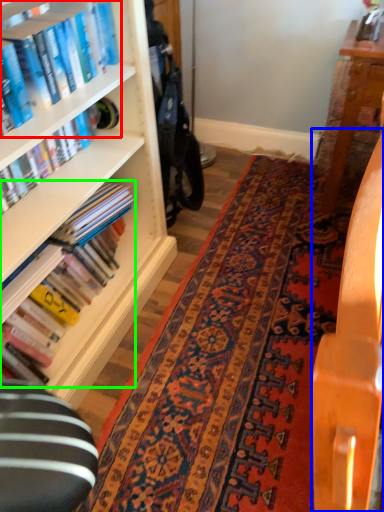
Question: Which is nearer to the book (highlighted by a red box)? table (highlighted by a blue box) or book (highlighted by a green box).

Choices:
 (A) table
 (B) book

Answer: (B)